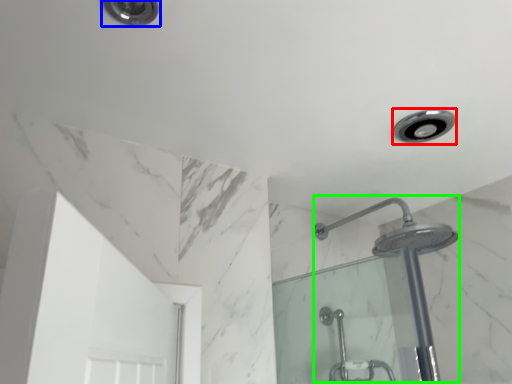
Question: Considering the real-world distances, which object is farthest from light fixture (highlighted by a red box)? light fixture (highlighted by a blue box) or shower (highlighted by a green box)?

Choices:
 (A) light fixture
 (B) shower

Answer: (A)